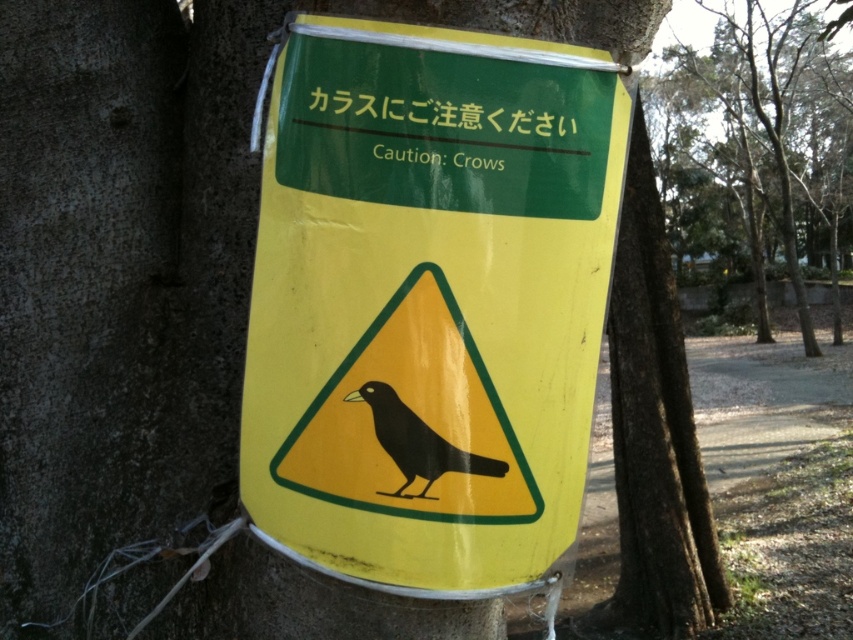
Does point (532, 422) come in front of point (463, 460)?

That is False.

Who is positioned more to the left, yellow matte sign at center or black matte bird at center?

black matte bird at center is more to the left.

Locate an element on the screen. yellow matte sign at center is located at coordinates (428, 301).

Between smooth bark tree at upper right and black matte bird at center, which one is positioned higher?

→ smooth bark tree at upper right is above.

Does smooth bark tree at upper right lie in front of black matte bird at center?

No, smooth bark tree at upper right is behind black matte bird at center.

Is point (814, 140) farther from viewer compared to point (486, 464)?

That is True.

You are a GUI agent. You are given a task and a screenshot of the screen. Output one action in this format:
    pyautogui.click(x=<x>, y=<y>)
    Task: Click on the smooth bark tree at upper right
    This screenshot has width=853, height=640.
    Given the screenshot: What is the action you would take?
    pyautogui.click(x=766, y=120)

What do you see at coordinates (428, 301) in the screenshot? I see `yellow matte sign at center` at bounding box center [428, 301].

Which of these two, yellow matte sign at center or smooth bark tree at upper right, stands shorter?

With less height is yellow matte sign at center.

Describe the element at coordinates (428, 301) in the screenshot. This screenshot has height=640, width=853. I see `yellow matte sign at center` at that location.

Image resolution: width=853 pixels, height=640 pixels. What are the coordinates of `yellow matte sign at center` in the screenshot? It's located at (428, 301).